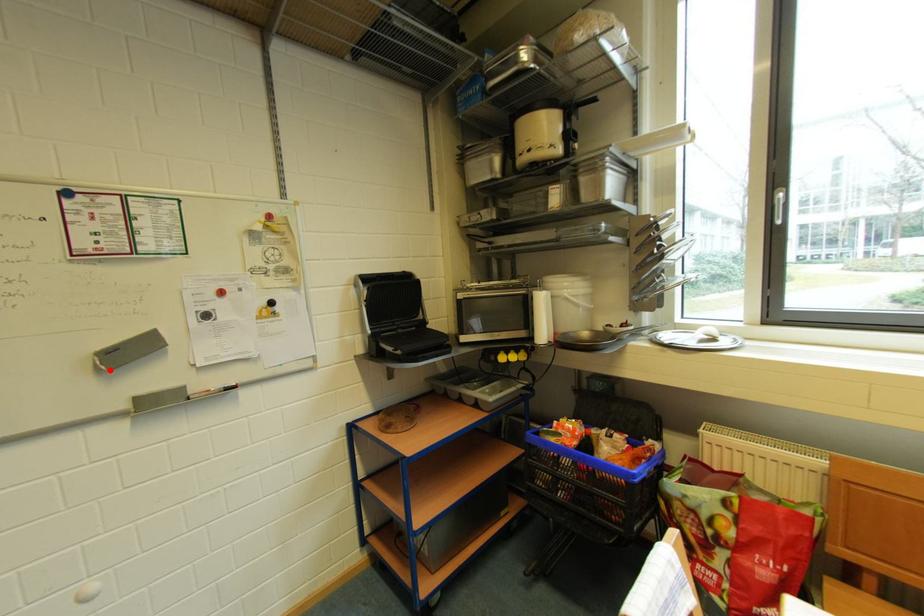
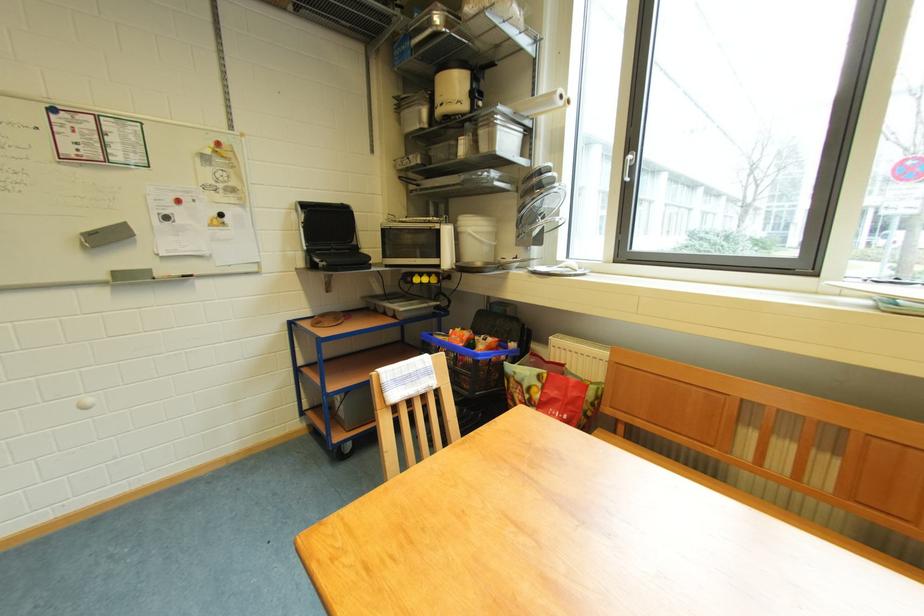
Question: I am providing you with two images of the same scene from different viewpoints. A red point is marked on the first image. Is the red point's position out of view in image 2?

Choices:
 (A) Yes
 (B) No

Answer: (B)